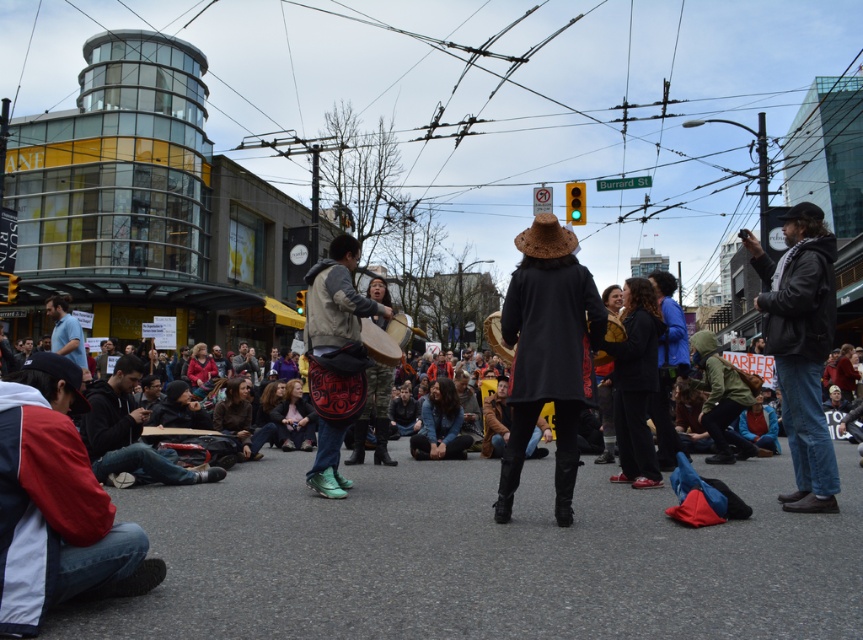
Question: Which point is farther from the camera taking this photo?

Choices:
 (A) (318, 333)
 (B) (509, 440)
 (C) (811, 336)
 (D) (362, 324)

Answer: (D)

Question: Which point is closer to the camera?

Choices:
 (A) (347, 250)
 (B) (817, 337)
 (C) (564, 404)

Answer: (C)

Question: In this image, where is black matte coat at center located relative to leather drum at center?

Choices:
 (A) right
 (B) left

Answer: (A)

Question: Is denim jacket at right below wooden drum at center?

Choices:
 (A) yes
 (B) no

Answer: (A)

Question: Estimate the real-world distances between objects in this image. Which object is closer to the black matte coat at center?

Choices:
 (A) leather drum at center
 (B) denim jacket at right
 (C) wooden drum at center

Answer: (A)

Question: Does denim jacket at right have a larger size compared to leather drum at center?

Choices:
 (A) yes
 (B) no

Answer: (A)